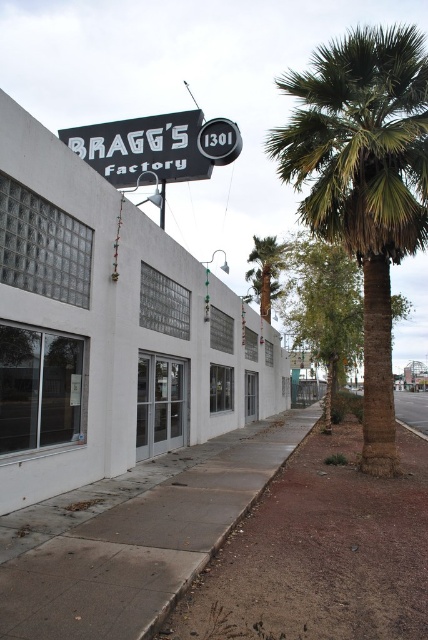
Is point (35, 588) behind point (265, 280)?

That is False.

Does gray concrete sidewalk at lower center appear under green leafy palm tree at center?

Correct, gray concrete sidewalk at lower center is located below green leafy palm tree at center.

Which is behind, point (249, 451) or point (276, 250)?

The point (276, 250) is more distant.

Where is `gray concrete sidewalk at lower center`? gray concrete sidewalk at lower center is located at coordinates (142, 545).

Is point (115, 170) positioned behind point (273, 252)?

No.

Who is more distant from viewer, (x=210, y=160) or (x=258, y=262)?

Positioned behind is point (x=258, y=262).

Image resolution: width=428 pixels, height=640 pixels. I want to click on black plastic sign at upper center, so click(155, 147).

Does white matte building at center appear on the right side of green leafy palm tree at center?

In fact, white matte building at center is to the left of green leafy palm tree at center.

Which is above, white matte building at center or green leafy palm tree at center?

green leafy palm tree at center is higher up.

What do you see at coordinates (109, 328) in the screenshot? This screenshot has height=640, width=428. I see `white matte building at center` at bounding box center [109, 328].

The height and width of the screenshot is (640, 428). In order to click on white matte building at center in this screenshot , I will do `click(109, 328)`.